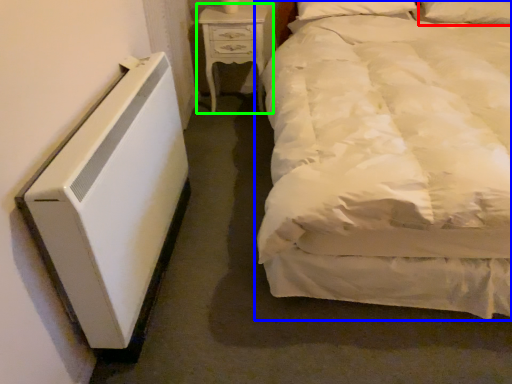
Question: Based on their relative distances, which object is nearer to pillow (highlighted by a red box)? Choose from bed (highlighted by a blue box) and nightstand (highlighted by a green box).

Choices:
 (A) bed
 (B) nightstand

Answer: (B)